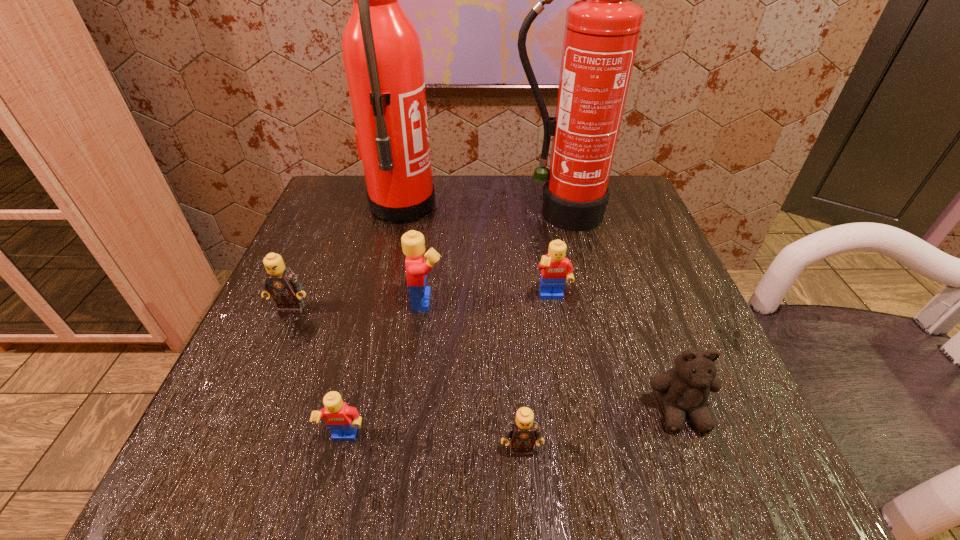
Image resolution: width=960 pixels, height=540 pixels. I want to click on Lego situated at the left edge, so click(x=281, y=283).

Find the location of a particular element. fire extinguisher that is at the right edge is located at coordinates (602, 30).

I want to click on teddy bear that is at the right edge, so click(x=684, y=390).

Locate an element on the screen. object that is at the far left corner is located at coordinates (381, 50).

Find the location of a particular element. object that is at the far right corner is located at coordinates (602, 30).

Where is `object located at the near right corner`? This screenshot has width=960, height=540. object located at the near right corner is located at coordinates (684, 390).

Image resolution: width=960 pixels, height=540 pixels. In order to click on vacant point at the far edge in this screenshot , I will do `click(519, 199)`.

The height and width of the screenshot is (540, 960). In order to click on free space at the near edge of the desktop in this screenshot , I will do `click(493, 432)`.

Find the location of `vacant space at the left edge of the desktop`. vacant space at the left edge of the desktop is located at coordinates (314, 258).

Image resolution: width=960 pixels, height=540 pixels. What are the coordinates of `vacant space at the right edge` in the screenshot? It's located at 697,322.